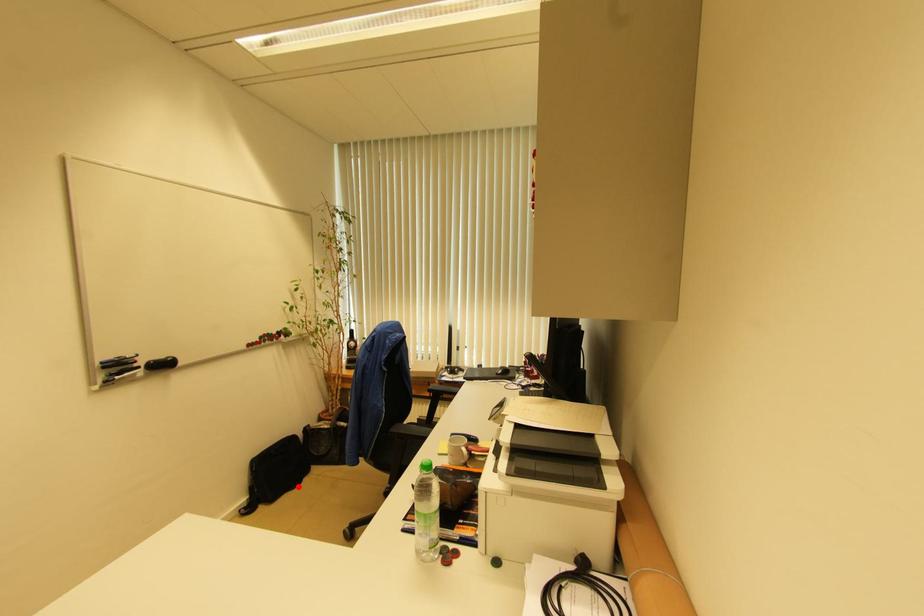
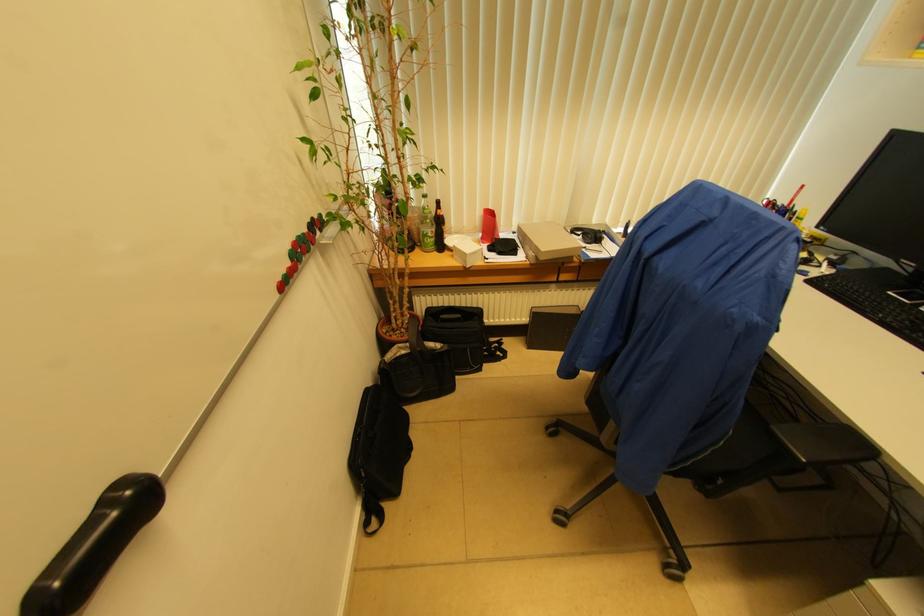
Question: A red point is marked in image1. In image2, is the corresponding 3D point closer to the camera or farther? Reply with the corresponding letter.

Choices:
 (A) The corresponding 3D point is closer.
 (B) The corresponding 3D point is farther.

Answer: (A)